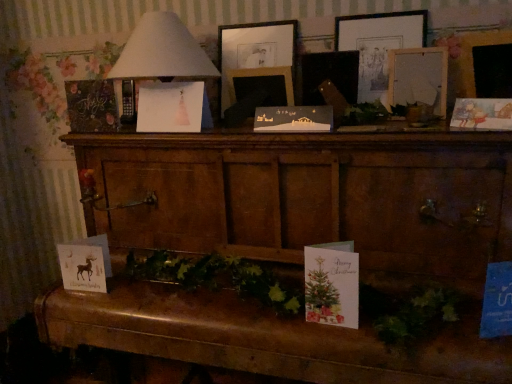
Question: Does pink paper christmas card at center, the 4th christmas card positioned from the bottom, have a greater width compared to matte black picture frame at center, the second picture frame when ordered from right to left?

Choices:
 (A) yes
 (B) no

Answer: (A)

Question: Can you confirm if pink paper christmas card at center, the third christmas card viewed from the left, is thinner than matte black picture frame at center, the second picture frame when ordered from right to left?

Choices:
 (A) yes
 (B) no

Answer: (B)

Question: Is pink paper christmas card at center, the third christmas card viewed from the left, at the right side of matte black picture frame at center, the second picture frame when ordered from right to left?

Choices:
 (A) yes
 (B) no

Answer: (B)

Question: Is pink paper christmas card at center, the third christmas card viewed from the left, aimed at matte black picture frame at center, the second picture frame when ordered from right to left?

Choices:
 (A) no
 (B) yes

Answer: (A)

Question: Can you confirm if pink paper christmas card at center, the 4th christmas card positioned from the bottom, is shorter than matte black picture frame at center, the third picture frame when ordered from left to right?

Choices:
 (A) yes
 (B) no

Answer: (A)

Question: From their relative heights in the image, would you say white paper christmas card at center, the 3th christmas card viewed from the top, is taller or shorter than chalkboard paper at left, the fifth christmas card when ordered from right to left?

Choices:
 (A) tall
 (B) short

Answer: (B)

Question: Is white paper christmas card at center, the 3th christmas card viewed from the top, to the left or to the right of chalkboard paper at left, placed as the first christmas card when sorted from top to bottom, in the image?

Choices:
 (A) right
 (B) left

Answer: (A)

Question: Is point (275, 114) positioned closer to the camera than point (72, 114)?

Choices:
 (A) farther
 (B) closer

Answer: (B)

Question: Is white paper christmas card at center, the 4th christmas card viewed from the left, wider or thinner than chalkboard paper at left, arranged as the 5th christmas card when ordered from the bottom?

Choices:
 (A) wide
 (B) thin

Answer: (B)

Question: From the image's perspective, relative to matte gold card with reindeer at lower left, which appears as the 1th christmas card when ordered from the bottom, is wooden picture frame at upper center, which ranks as the 1th picture frame in left-to-right order, above or below?

Choices:
 (A) below
 (B) above

Answer: (B)

Question: Considering the positions of wooden picture frame at upper center, marked as the fourth picture frame in a right-to-left arrangement, and matte gold card with reindeer at lower left, the 4th christmas card viewed from the right, in the image, is wooden picture frame at upper center, marked as the fourth picture frame in a right-to-left arrangement, wider or thinner than matte gold card with reindeer at lower left, the 4th christmas card viewed from the right,?

Choices:
 (A) thin
 (B) wide

Answer: (A)

Question: Is wooden picture frame at upper center, which ranks as the 1th picture frame in left-to-right order, taller or shorter than matte gold card with reindeer at lower left, arranged as the fifth christmas card when viewed from the top?

Choices:
 (A) tall
 (B) short

Answer: (A)

Question: Considering their positions, is wooden picture frame at upper center, marked as the fourth picture frame in a right-to-left arrangement, located in front of or behind matte gold card with reindeer at lower left, the 2th christmas card from the left?

Choices:
 (A) front
 (B) behind

Answer: (B)

Question: Considering the positions of wooden chest at center and pink paper christmas card at center, the 4th christmas card positioned from the bottom, in the image, is wooden chest at center bigger or smaller than pink paper christmas card at center, the 4th christmas card positioned from the bottom,?

Choices:
 (A) small
 (B) big

Answer: (B)

Question: Is wooden chest at center inside or outside of pink paper christmas card at center, the third christmas card viewed from the left?

Choices:
 (A) inside
 (B) outside

Answer: (B)